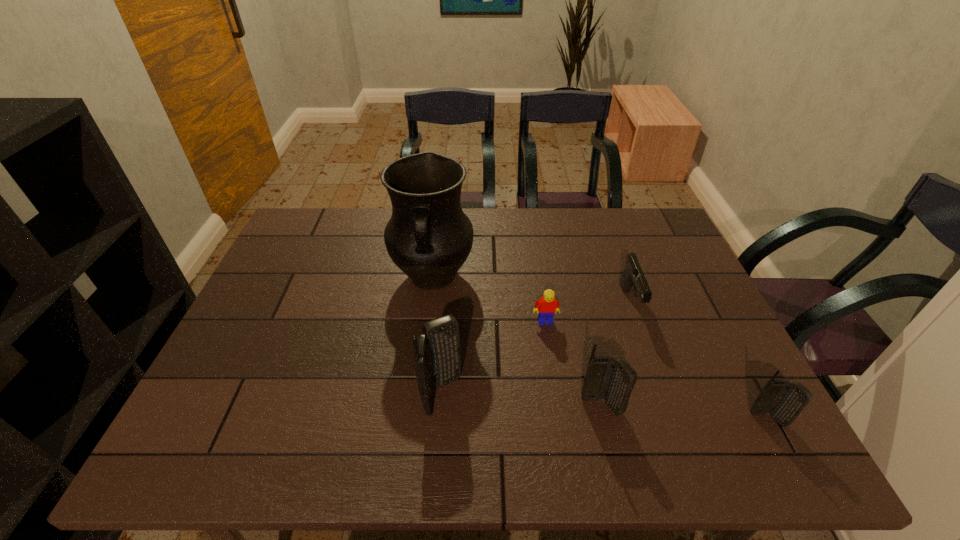
This screenshot has width=960, height=540. I want to click on vacant space located aim along the barrel of the second object from right to left, so click(x=672, y=418).

You are a GUI agent. You are given a task and a screenshot of the screen. Output one action in this format:
    pyautogui.click(x=<x>, y=<y>)
    Task: Click on the free space located on the front-facing side of the Lego
    The height and width of the screenshot is (540, 960).
    Given the screenshot: What is the action you would take?
    pyautogui.click(x=550, y=353)

Find the location of a particular element. Image resolution: width=960 pixels, height=540 pixels. free region located 0.250m on the handle side of the pitcher is located at coordinates (420, 388).

This screenshot has height=540, width=960. Identify the location of object present at the far edge. (429, 237).

Locate an element on the screen. object located at the right edge is located at coordinates (784, 400).

Where is `object present at the near right corner`? Image resolution: width=960 pixels, height=540 pixels. object present at the near right corner is located at coordinates (784, 400).

You are a GUI agent. You are given a task and a screenshot of the screen. Output one action in this format:
    pyautogui.click(x=<x>, y=<y>)
    Task: Click on the free space at the far edge of the desktop
    This screenshot has width=960, height=540.
    Given the screenshot: What is the action you would take?
    pyautogui.click(x=503, y=223)

Locate an element on the screen. The height and width of the screenshot is (540, 960). free space at the near edge is located at coordinates (577, 419).

In the image, there is a desktop. Where is `vacant space at the left edge`? The image size is (960, 540). vacant space at the left edge is located at coordinates (269, 321).

You are a GUI agent. You are given a task and a screenshot of the screen. Output one action in this format:
    pyautogui.click(x=<x>, y=<y>)
    Task: Click on the vacant region at the right edge of the desktop
    This screenshot has width=960, height=540.
    Given the screenshot: What is the action you would take?
    pyautogui.click(x=663, y=266)